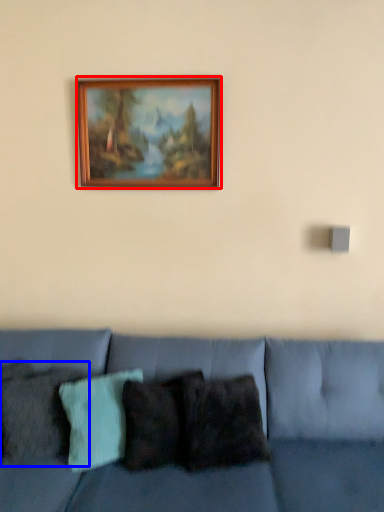
Question: Which object appears farthest to the camera in this image, picture frame (highlighted by a red box) or pillow (highlighted by a blue box)?

Choices:
 (A) picture frame
 (B) pillow

Answer: (A)